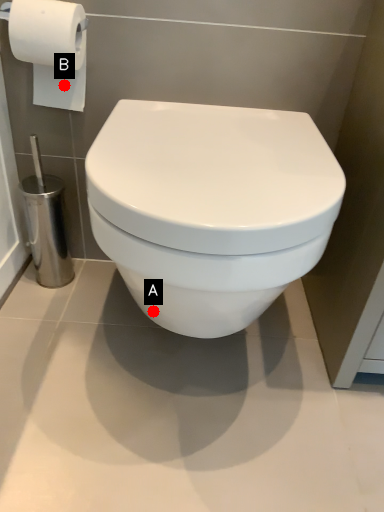
Question: Two points are circled on the image, labeled by A and B beside each circle. Which point appears closest to the camera in this image?

Choices:
 (A) A is closer
 (B) B is closer

Answer: (A)